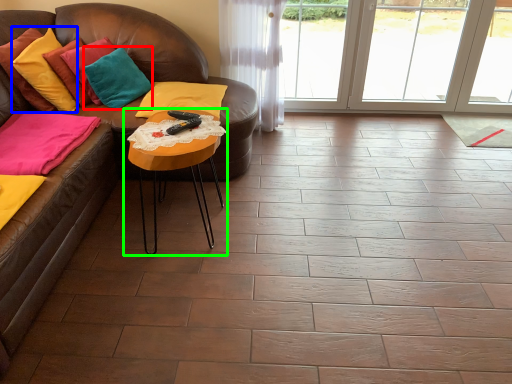
Question: Based on their relative distances, which object is nearer to pillow (highlighted by a red box)? Choose from pillow (highlighted by a blue box) and table (highlighted by a green box).

Choices:
 (A) pillow
 (B) table

Answer: (A)